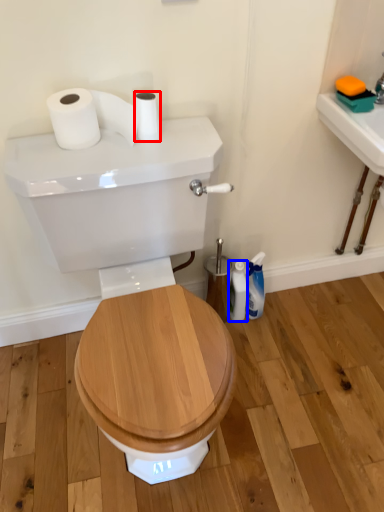
Question: Which object is closer to the camera taking this photo, toilet paper (highlighted by a red box) or toiletry (highlighted by a blue box)?

Choices:
 (A) toilet paper
 (B) toiletry

Answer: (A)